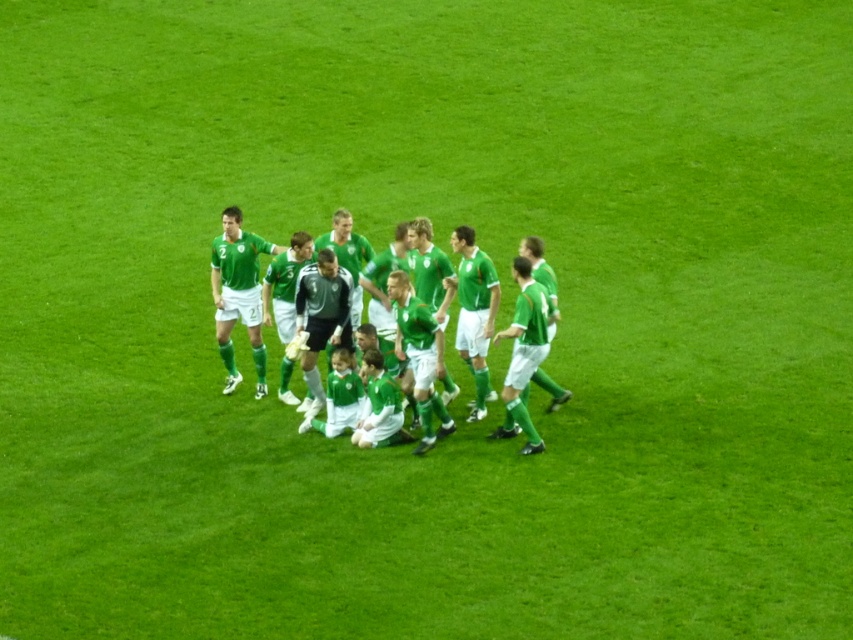
You are a photographer standing at the center of the soccer field. You want to take a photo of the two points marked in the image. Which point, point (253,328) or point (300,330), is closer to you?

Point (253,328) is closer to you because it is further to the viewer than point (300,330).

You are a soccer player standing at the center of the field. You see two points marked on the field, point 1 at coordinates point (331, 244) and point 2 at coordinates point (223, 337). Which point is closer to you?

Point 2 at coordinates point (223, 337) is closer to you because it is in front of point 1 at coordinates point (331, 244).